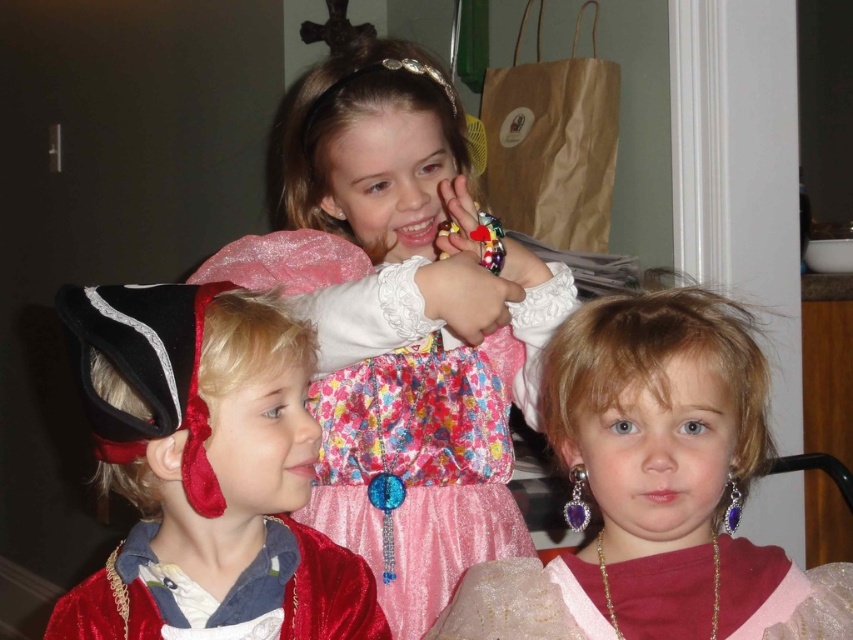
Question: Can you confirm if pink satin dress at center is bigger than pink tulle dress at center?

Choices:
 (A) no
 (B) yes

Answer: (B)

Question: Can you confirm if velvet red pirate costume at left is positioned above pink satin dress at center?

Choices:
 (A) no
 (B) yes

Answer: (B)

Question: Which point is closer to the camera?

Choices:
 (A) (125, 541)
 (B) (126, 372)

Answer: (B)

Question: Which object is the farthest from the velvet red pirate costume at left?

Choices:
 (A) velvet red cape at lower left
 (B) pink satin dress at center

Answer: (B)

Question: Can you confirm if fluffy pink dress at center is positioned to the left of velvet red pirate costume at left?

Choices:
 (A) no
 (B) yes

Answer: (A)

Question: Which point is farther from the camera taking this photo?

Choices:
 (A) (685, 600)
 (B) (242, 410)
 (C) (701, 317)
 (D) (378, 608)

Answer: (D)